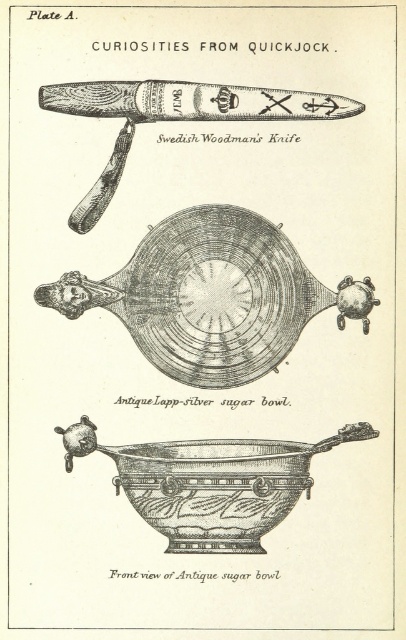
Does black polished silver bowl at center have a smaller size compared to antique silver sugar bowl at center?

No.

Find the location of a particular element. The width and height of the screenshot is (406, 640). black polished silver bowl at center is located at coordinates (211, 296).

In the scene shown: Is black polished silver bowl at center to the left of matte wood swedish woodman's knife at upper center from the viewer's perspective?

Yes, black polished silver bowl at center is to the left of matte wood swedish woodman's knife at upper center.

Between point (293, 282) and point (101, 92), which one is positioned in front?

Point (101, 92) is more forward.

This screenshot has height=640, width=406. I want to click on black polished silver bowl at center, so click(x=211, y=296).

Where is `antique silver sugar bowl at center`? The height and width of the screenshot is (640, 406). antique silver sugar bowl at center is located at coordinates (211, 483).

What are the coordinates of `antique silver sugar bowl at center` in the screenshot? It's located at (211, 483).